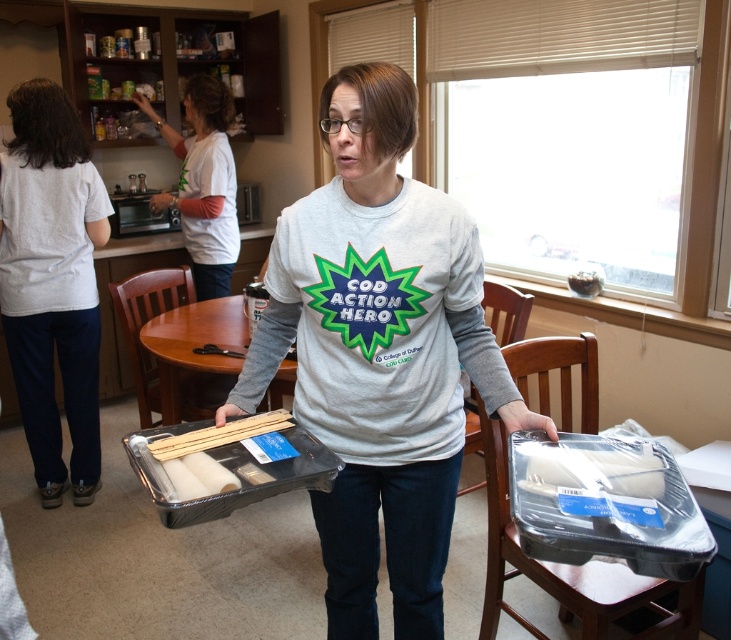
You are a volunteer at the event and need to place a 20 inch wide box on the table. Can the white cotton shirt at left be placed on the brown wooden table at center without moving the box?

The white cotton shirt at left is 22.01 inches from the brown wooden table at center. Since the distance between them is greater than the box width of 20 inches, the shirt cannot be placed on the table without moving the box.